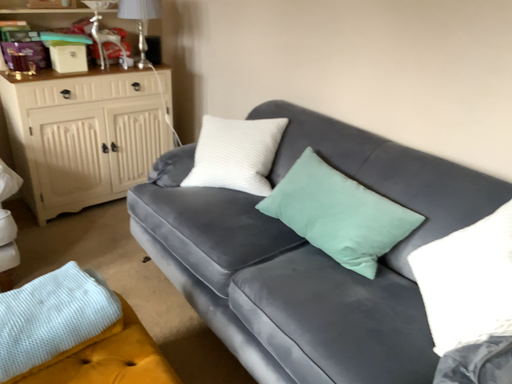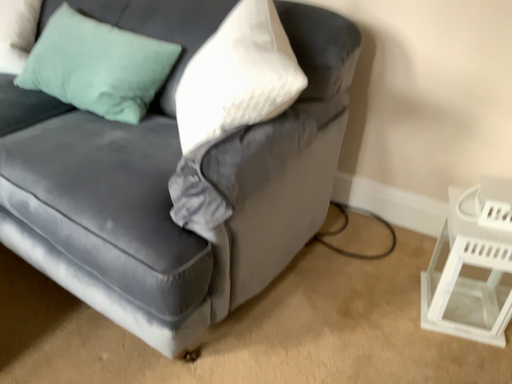
Question: Which way did the camera rotate in the video?

Choices:
 (A) rotated upward
 (B) rotated downward

Answer: (B)